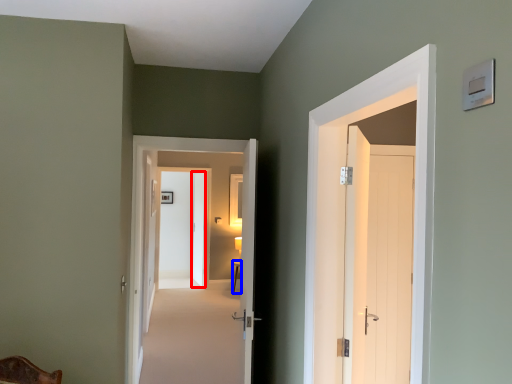
Question: Which object is closer to the camera taking this photo, door (highlighted by a red box) or table (highlighted by a blue box)?

Choices:
 (A) door
 (B) table

Answer: (B)